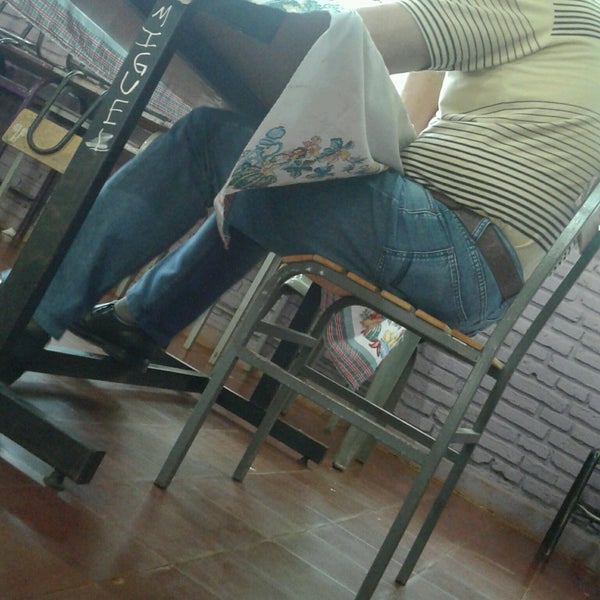
You are a GUI agent. You are given a task and a screenshot of the screen. Output one action in this format:
    pyautogui.click(x=<x>, y=<y>)
    Task: Click on the wood base
    
    Given the screenshot: What is the action you would take?
    pyautogui.click(x=421, y=313), pyautogui.click(x=401, y=302)